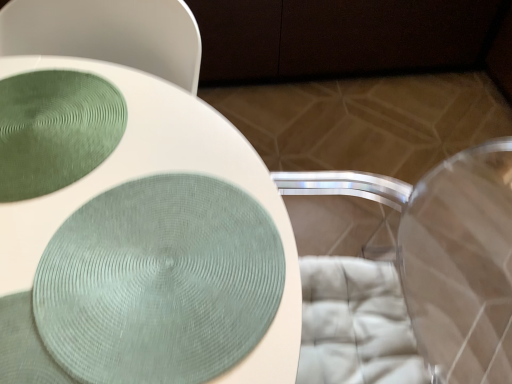
Locate an element on the screen. The image size is (512, 384). green textured glass plate at upper left is located at coordinates (55, 130).

From a real-world perspective, is transparent plastic swivel chair at lower right beneath matte green fabric at center?

No, from a real-world perspective, transparent plastic swivel chair at lower right is not under matte green fabric at center.

Is point (465, 274) closer or farther from the camera than point (18, 258)?

Point (465, 274).

How many degrees apart are the facing directions of transparent plastic swivel chair at lower right and matte green fabric at center?

1.76e-05 degrees separate the facing orientations of transparent plastic swivel chair at lower right and matte green fabric at center.

Is transparent plastic swivel chair at lower right not within matte green fabric at center?

transparent plastic swivel chair at lower right lies outside matte green fabric at center's area.

Does green textured glass plate at upper left turn towards transparent plastic swivel chair at lower right?

No, green textured glass plate at upper left does not turn towards transparent plastic swivel chair at lower right.

Could you measure the distance between green textured glass plate at upper left and transparent plastic swivel chair at lower right?

A distance of 37.14 inches exists between green textured glass plate at upper left and transparent plastic swivel chair at lower right.

Which object is thinner, green textured glass plate at upper left or transparent plastic swivel chair at lower right?

green textured glass plate at upper left.

Who is bigger, green textured glass plate at upper left or transparent plastic swivel chair at lower right?

transparent plastic swivel chair at lower right is bigger.

Considering the positions of point (9, 227) and point (469, 273), is point (9, 227) closer or farther from the camera than point (469, 273)?

Point (9, 227) appears to be closer to the viewer than point (469, 273).

Where is `swivel chair above the matte green fabric at center (from a real-world perspective)`? The image size is (512, 384). swivel chair above the matte green fabric at center (from a real-world perspective) is located at coordinates (430, 250).

From the image's perspective, which one is positioned lower, matte green fabric at center or transparent plastic swivel chair at lower right?

transparent plastic swivel chair at lower right, from the image's perspective.

From a real-world perspective, is green textured glass plate at upper left positioned under matte green fabric at center based on gravity?

Incorrect, from a real-world perspective, green textured glass plate at upper left is higher than matte green fabric at center.

Which is less distant, [61,157] or [273,206]?

Point [61,157] is farther from the camera than point [273,206].

Is green textured glass plate at upper left next to matte green fabric at center and touching it?

green textured glass plate at upper left and matte green fabric at center are not in contact.

Between green textured glass plate at upper left and matte green fabric at center, which one has smaller width?

green textured glass plate at upper left.

From the image's perspective, is transparent plastic swivel chair at lower right on green textured glass plate at upper left?

No, from the image's perspective, transparent plastic swivel chair at lower right is not above green textured glass plate at upper left.

Considering the sizes of transparent plastic swivel chair at lower right and green textured glass plate at upper left in the image, is transparent plastic swivel chair at lower right taller or shorter than green textured glass plate at upper left?

transparent plastic swivel chair at lower right is taller than green textured glass plate at upper left.

How far apart are transparent plastic swivel chair at lower right and green textured glass plate at upper left?

transparent plastic swivel chair at lower right is 37.14 inches from green textured glass plate at upper left.

Which object is thinner, transparent plastic swivel chair at lower right or green textured glass plate at upper left?

Thinner between the two is green textured glass plate at upper left.

Between point (81, 190) and point (11, 154), which one is positioned in front?

The point (81, 190) is closer.

Would you say matte green fabric at center contains green textured glass plate at upper left?

Yes, matte green fabric at center is surrounding green textured glass plate at upper left.

You are a GUI agent. You are given a task and a screenshot of the screen. Output one action in this format:
    pyautogui.click(x=<x>, y=<y>)
    Task: Click on the toilet in front of the green textured glass plate at upper left
    The image size is (512, 384).
    Given the screenshot: What is the action you would take?
    pyautogui.click(x=159, y=173)

Visually, is matte green fabric at center positioned to the left or to the right of green textured glass plate at upper left?

In the image, matte green fabric at center appears on the right side of green textured glass plate at upper left.

In the image, there is a transparent plastic swivel chair at lower right. Where is `toilet below it (from a real-world perspective)`? The height and width of the screenshot is (384, 512). toilet below it (from a real-world perspective) is located at coordinates (159, 173).

Identify the location of glass plate above the transparent plastic swivel chair at lower right (from the image's perspective). (55, 130).

Estimate the real-world distances between objects in this image. Which object is closer to green textured glass plate at upper left, matte green fabric at center or transparent plastic swivel chair at lower right?

matte green fabric at center.

Looking at this image, estimate the real-world distances between objects in this image. Which object is closer to matte green fabric at center, transparent plastic swivel chair at lower right or green textured glass plate at upper left?

Among the two, green textured glass plate at upper left is located nearer to matte green fabric at center.

Which object lies further to the anchor point green textured glass plate at upper left, transparent plastic swivel chair at lower right or matte green fabric at center?

transparent plastic swivel chair at lower right lies further to green textured glass plate at upper left than the other object.

Estimate the real-world distances between objects in this image. Which object is closer to transparent plastic swivel chair at lower right, green textured glass plate at upper left or matte green fabric at center?

Based on the image, matte green fabric at center appears to be nearer to transparent plastic swivel chair at lower right.

From the image, which object appears to be farther from matte green fabric at center, green textured glass plate at upper left or transparent plastic swivel chair at lower right?

Based on the image, transparent plastic swivel chair at lower right appears to be further to matte green fabric at center.

Which object lies further to the anchor point transparent plastic swivel chair at lower right, matte green fabric at center or green textured glass plate at upper left?

green textured glass plate at upper left lies further to transparent plastic swivel chair at lower right than the other object.

Where is `toilet located between green textured glass plate at upper left and transparent plastic swivel chair at lower right in the left-right direction`? toilet located between green textured glass plate at upper left and transparent plastic swivel chair at lower right in the left-right direction is located at coordinates (159, 173).